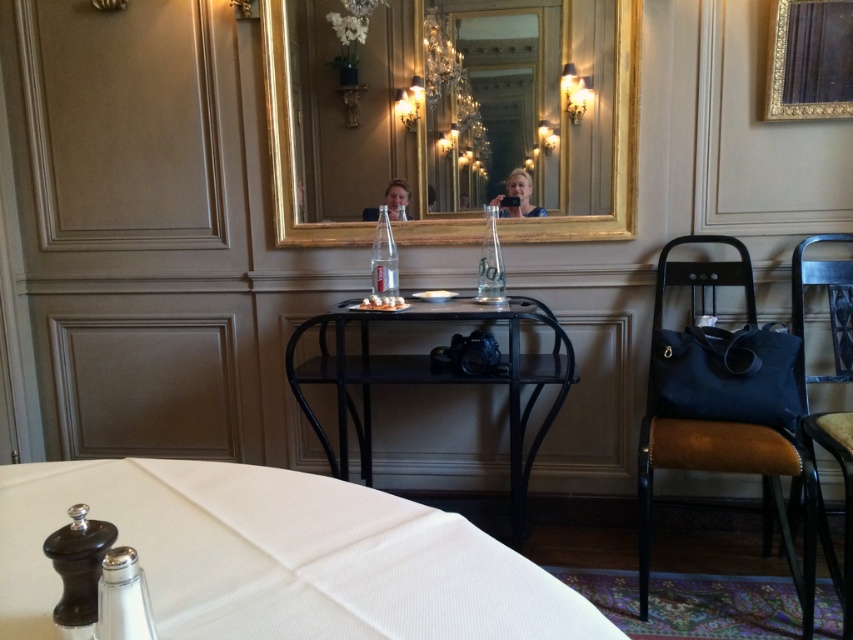
Question: Which point appears closest to the camera in this image?

Choices:
 (A) (709, 328)
 (B) (805, 408)

Answer: (B)

Question: Is leather brown chair at right below matte plastic water bottle at center?

Choices:
 (A) no
 (B) yes

Answer: (B)

Question: Does gold/gilded mirror at upper center have a lesser width compared to matte black camera at center?

Choices:
 (A) yes
 (B) no

Answer: (B)

Question: Which object is the closest to the leather brown chair at right?

Choices:
 (A) white fabric tablecloth at lower center
 (B) matte black camera at center

Answer: (B)

Question: Among these objects, which one is nearest to the camera?

Choices:
 (A) leather brown chair at right
 (B) gold/gilded mirror at upper center
 (C) white fabric tablecloth at lower center

Answer: (C)

Question: Can you confirm if matte black camera at center is positioned above matte plastic water bottle at center?

Choices:
 (A) yes
 (B) no

Answer: (A)